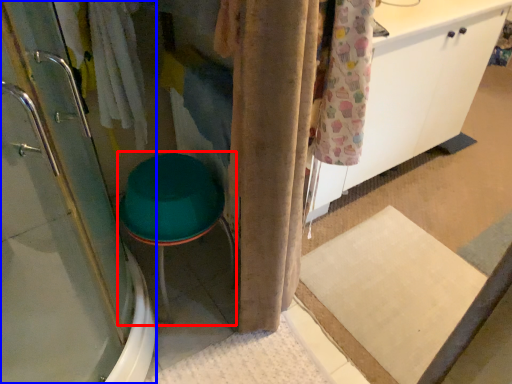
Question: Which object is further to the camera taking this photo, step stool (highlighted by a red box) or shower door (highlighted by a blue box)?

Choices:
 (A) step stool
 (B) shower door

Answer: (A)